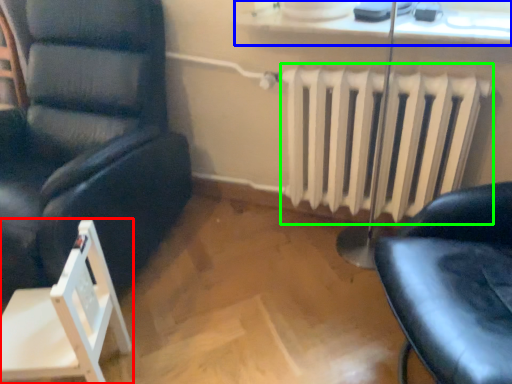
Question: Which object is the farthest from chair (highlighted by a red box)? Choose among these: window sill (highlighted by a blue box) or radiator (highlighted by a green box).

Choices:
 (A) window sill
 (B) radiator

Answer: (A)